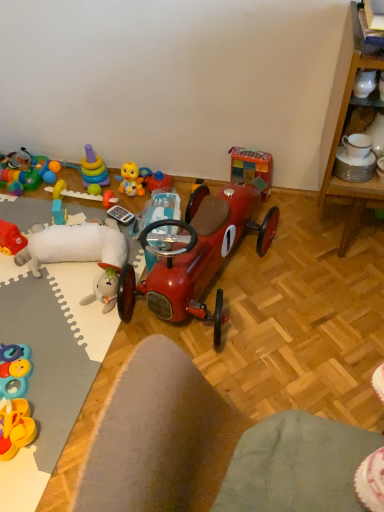
Locate an element on the screen. This screenshot has height=512, width=384. free area in between wooden cabinet at right and wooden block tower at upper right, the first toy in the right-to-left sequence is located at coordinates (289, 218).